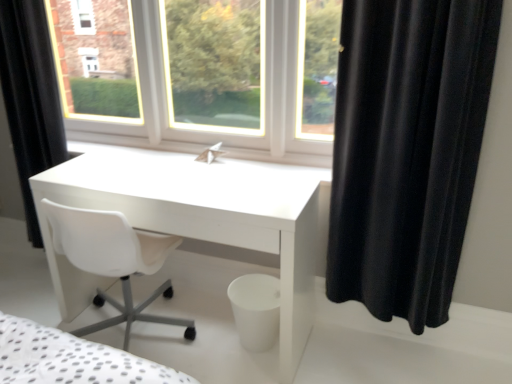
Question: Is black velvet curtain at right, marked as the 1th curtain in a front-to-back arrangement, surrounded by black matte curtain at left, which ranks as the 2th curtain in right-to-left order?

Choices:
 (A) yes
 (B) no

Answer: (B)

Question: Is black matte curtain at left, the 1th curtain in the left-to-right sequence, next to black velvet curtain at right, marked as the 1th curtain in a front-to-back arrangement, and touching it?

Choices:
 (A) yes
 (B) no

Answer: (B)

Question: Is black matte curtain at left, the 1th curtain in the left-to-right sequence, oriented towards black velvet curtain at right, the 1th curtain from the right?

Choices:
 (A) no
 (B) yes

Answer: (A)

Question: From a real-world perspective, is black matte curtain at left, which ranks as the 2th curtain in right-to-left order, on black velvet curtain at right, placed as the 2th curtain when sorted from left to right?

Choices:
 (A) yes
 (B) no

Answer: (A)

Question: Does black matte curtain at left, which ranks as the 2th curtain in front-to-back order, come behind black velvet curtain at right, the 1th curtain from the right?

Choices:
 (A) yes
 (B) no

Answer: (A)

Question: Is black matte curtain at left, the 1th curtain from the back, looking in the opposite direction of black velvet curtain at right, the 1th curtain from the right?

Choices:
 (A) no
 (B) yes

Answer: (A)

Question: Is white glossy desk at center shorter than black velvet curtain at right, placed as the 2th curtain when sorted from left to right?

Choices:
 (A) no
 (B) yes

Answer: (B)

Question: Is white glossy desk at center oriented towards black velvet curtain at right, the 1th curtain from the right?

Choices:
 (A) yes
 (B) no

Answer: (B)

Question: Is white glossy desk at center far away from black velvet curtain at right, marked as the 1th curtain in a front-to-back arrangement?

Choices:
 (A) no
 (B) yes

Answer: (A)

Question: Can you confirm if white glossy desk at center is smaller than black velvet curtain at right, marked as the 1th curtain in a front-to-back arrangement?

Choices:
 (A) no
 (B) yes

Answer: (A)

Question: From a real-world perspective, is white glossy desk at center on black velvet curtain at right, the 1th curtain from the right?

Choices:
 (A) no
 (B) yes

Answer: (A)

Question: From the image's perspective, is white glossy desk at center located beneath black velvet curtain at right, the 1th curtain from the right?

Choices:
 (A) yes
 (B) no

Answer: (A)

Question: Does white glossy desk at center touch black matte curtain at left, which ranks as the 2th curtain in front-to-back order?

Choices:
 (A) no
 (B) yes

Answer: (A)